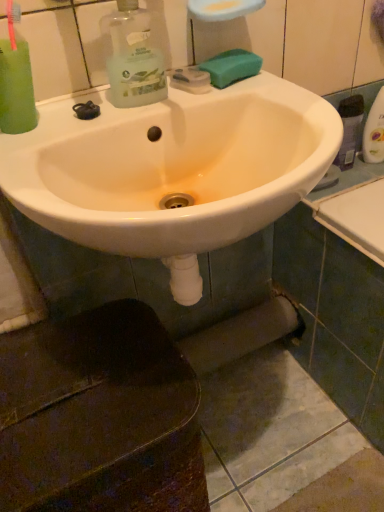
Question: Could green sponge at upper right be considered to be inside white glossy sink at center?

Choices:
 (A) no
 (B) yes

Answer: (B)

Question: Can you confirm if white glossy sink at center is thinner than green sponge at upper right?

Choices:
 (A) no
 (B) yes

Answer: (A)

Question: Are white glossy sink at center and green sponge at upper right beside each other?

Choices:
 (A) yes
 (B) no

Answer: (B)

Question: Considering the relative sizes of white glossy sink at center and green sponge at upper right in the image provided, is white glossy sink at center bigger than green sponge at upper right?

Choices:
 (A) no
 (B) yes

Answer: (B)

Question: Is white glossy sink at center looking in the opposite direction of green sponge at upper right?

Choices:
 (A) no
 (B) yes

Answer: (A)

Question: Is white glossy sink at center behind green sponge at upper right?

Choices:
 (A) no
 (B) yes

Answer: (A)

Question: Does green sponge at upper right have a greater width compared to white glossy sink at center?

Choices:
 (A) no
 (B) yes

Answer: (A)

Question: Would you consider green sponge at upper right to be distant from white glossy sink at center?

Choices:
 (A) no
 (B) yes

Answer: (A)

Question: Does green sponge at upper right turn towards white glossy sink at center?

Choices:
 (A) yes
 (B) no

Answer: (B)

Question: From a real-world perspective, is green sponge at upper right physically above white glossy sink at center?

Choices:
 (A) yes
 (B) no

Answer: (A)

Question: Does green sponge at upper right have a lesser width compared to white glossy sink at center?

Choices:
 (A) yes
 (B) no

Answer: (A)

Question: Is green sponge at upper right shorter than white glossy sink at center?

Choices:
 (A) yes
 (B) no

Answer: (A)

Question: In terms of size, does green sponge at upper right appear bigger or smaller than white glossy sink at center?

Choices:
 (A) big
 (B) small

Answer: (B)